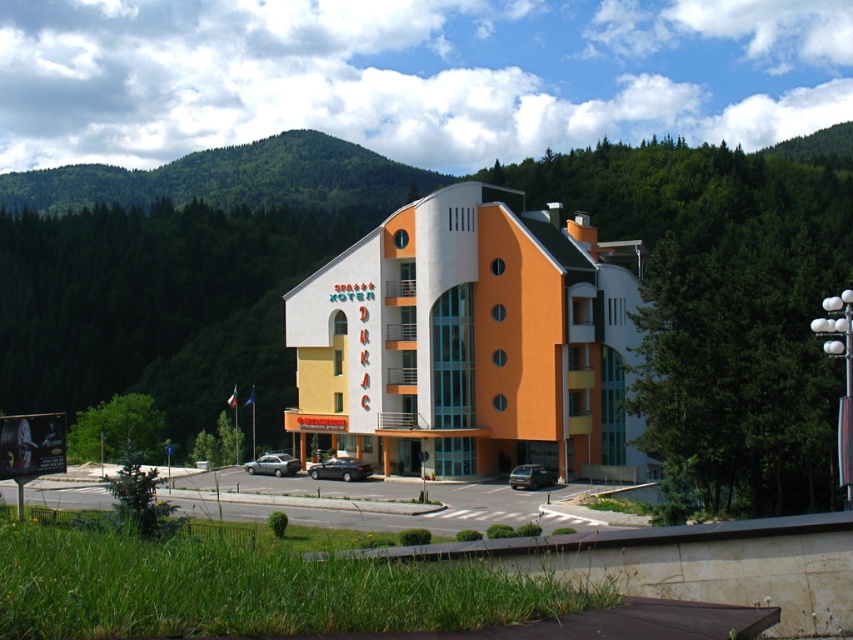
Question: Is satin black sedan at center closer to camera compared to silver metallic sedan at center?

Choices:
 (A) no
 (B) yes

Answer: (B)

Question: Which of the following is the farthest from the observer?

Choices:
 (A) silver metallic sedan at center
 (B) orange matte building at center
 (C) satin black sedan at center

Answer: (A)

Question: Based on their relative distances, which object is nearer to the dark gray matte van at lower center?

Choices:
 (A) silver metallic sedan at center
 (B) orange matte building at center
 (C) green forested hillside at upper center

Answer: (B)

Question: Is green forested hillside at upper center to the right of dark gray matte van at lower center from the viewer's perspective?

Choices:
 (A) no
 (B) yes

Answer: (A)

Question: Among these points, which one is nearest to the camera?

Choices:
 (A) (524, 474)
 (B) (219, 189)
 (C) (297, 429)

Answer: (A)

Question: Does green forested hillside at upper center have a greater width compared to satin black sedan at center?

Choices:
 (A) yes
 (B) no

Answer: (A)